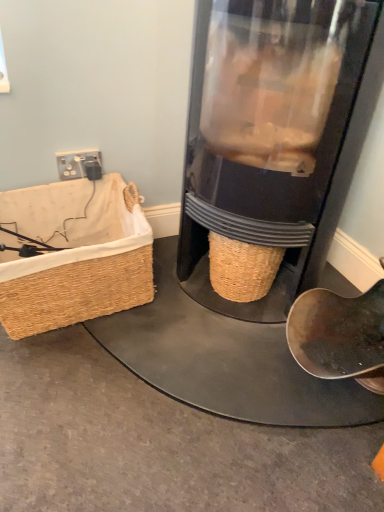
Find the location of `transparent plastic coffee grinder at center`. transparent plastic coffee grinder at center is located at coordinates (274, 135).

This screenshot has width=384, height=512. What do you see at coordinates (78, 164) in the screenshot? I see `black plastic plug at upper left` at bounding box center [78, 164].

The image size is (384, 512). Describe the element at coordinates (74, 254) in the screenshot. I see `woven straw picnic basket at left` at that location.

The height and width of the screenshot is (512, 384). Find the location of `transparent plastic coffee grinder at center`. transparent plastic coffee grinder at center is located at coordinates (274, 135).

Is black plastic plug at upper left in front of woven straw picnic basket at left?

No, the depth of black plastic plug at upper left is greater than that of woven straw picnic basket at left.

Would you consider black plastic plug at upper left to be distant from woven straw picnic basket at left?

Actually, black plastic plug at upper left and woven straw picnic basket at left are a little close together.

Is point (70, 169) closer to viewer compared to point (138, 223)?

No.

Considering the relative sizes of black plastic plug at upper left and transparent plastic coffee grinder at center in the image provided, is black plastic plug at upper left wider than transparent plastic coffee grinder at center?

In fact, black plastic plug at upper left might be narrower than transparent plastic coffee grinder at center.

Considering the sizes of black plastic plug at upper left and transparent plastic coffee grinder at center in the image, is black plastic plug at upper left taller or shorter than transparent plastic coffee grinder at center?

Clearly, black plastic plug at upper left is shorter compared to transparent plastic coffee grinder at center.

Looking at the image, does black plastic plug at upper left seem bigger or smaller compared to transparent plastic coffee grinder at center?

In the image, black plastic plug at upper left appears to be smaller than transparent plastic coffee grinder at center.

Is transparent plastic coffee grinder at center wider than woven straw picnic basket at left?

Correct, the width of transparent plastic coffee grinder at center exceeds that of woven straw picnic basket at left.

Is transparent plastic coffee grinder at center bigger or smaller than woven straw picnic basket at left?

transparent plastic coffee grinder at center is bigger than woven straw picnic basket at left.

Visually, is transparent plastic coffee grinder at center positioned to the left or to the right of woven straw picnic basket at left?

transparent plastic coffee grinder at center is to the right of woven straw picnic basket at left.

Where is `picnic basket on the left of transparent plastic coffee grinder at center`? The image size is (384, 512). picnic basket on the left of transparent plastic coffee grinder at center is located at coordinates (74, 254).

Is there a large distance between woven straw picnic basket at left and black plastic plug at upper left?

No, woven straw picnic basket at left is in close proximity to black plastic plug at upper left.

This screenshot has height=512, width=384. What are the coordinates of `picnic basket below the black plastic plug at upper left (from the image's perspective)` in the screenshot? It's located at (74, 254).

From the picture: Considering the positions of objects woven straw picnic basket at left and black plastic plug at upper left in the image provided, who is in front, woven straw picnic basket at left or black plastic plug at upper left?

woven straw picnic basket at left.

Can you confirm if woven straw picnic basket at left is smaller than transparent plastic coffee grinder at center?

Indeed, woven straw picnic basket at left has a smaller size compared to transparent plastic coffee grinder at center.

Does woven straw picnic basket at left appear on the right side of transparent plastic coffee grinder at center?

Incorrect, woven straw picnic basket at left is not on the right side of transparent plastic coffee grinder at center.

Is woven straw picnic basket at left facing away from transparent plastic coffee grinder at center?

No.

From a real-world perspective, between woven straw picnic basket at left and transparent plastic coffee grinder at center, who is vertically lower?

woven straw picnic basket at left.

Which of these two, transparent plastic coffee grinder at center or black plastic plug at upper left, is bigger?

transparent plastic coffee grinder at center is bigger.

Are transparent plastic coffee grinder at center and black plastic plug at upper left far apart?

transparent plastic coffee grinder at center is actually quite close to black plastic plug at upper left.

Which point is more forward, (241, 0) or (83, 163)?

Point (241, 0)

Consider the image. Considering the relative positions of transparent plastic coffee grinder at center and black plastic plug at upper left in the image provided, is transparent plastic coffee grinder at center to the right of black plastic plug at upper left from the viewer's perspective?

Correct, you'll find transparent plastic coffee grinder at center to the right of black plastic plug at upper left.

Find the location of a particular element. The height and width of the screenshot is (512, 384). picnic basket in front of the black plastic plug at upper left is located at coordinates (74, 254).

Identify the location of appliance located above the black plastic plug at upper left (from the image's perspective). (274, 135).

Estimate the real-world distances between objects in this image. Which object is further from transparent plastic coffee grinder at center, woven straw picnic basket at left or black plastic plug at upper left?

black plastic plug at upper left is positioned further to the anchor transparent plastic coffee grinder at center.

Which object lies nearer to the anchor point woven straw picnic basket at left, transparent plastic coffee grinder at center or black plastic plug at upper left?

black plastic plug at upper left is positioned closer to the anchor woven straw picnic basket at left.

Based on their spatial positions, is black plastic plug at upper left or woven straw picnic basket at left further from transparent plastic coffee grinder at center?

black plastic plug at upper left is further to transparent plastic coffee grinder at center.

Looking at the image, which one is located further to black plastic plug at upper left, transparent plastic coffee grinder at center or woven straw picnic basket at left?

Among the two, transparent plastic coffee grinder at center is located further to black plastic plug at upper left.

In the scene shown: When comparing their distances from woven straw picnic basket at left, does black plastic plug at upper left or transparent plastic coffee grinder at center seem further?

transparent plastic coffee grinder at center lies further to woven straw picnic basket at left than the other object.

Based on their spatial positions, is woven straw picnic basket at left or transparent plastic coffee grinder at center further from black plastic plug at upper left?

transparent plastic coffee grinder at center lies further to black plastic plug at upper left than the other object.

Image resolution: width=384 pixels, height=512 pixels. In order to click on plug located between woven straw picnic basket at left and transparent plastic coffee grinder at center in the left-right direction in this screenshot , I will do `click(78, 164)`.